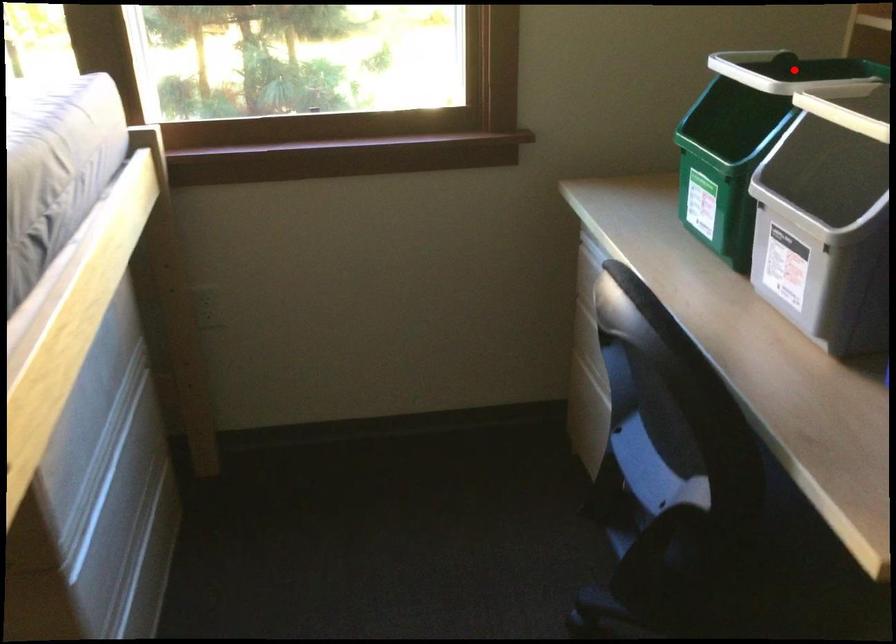
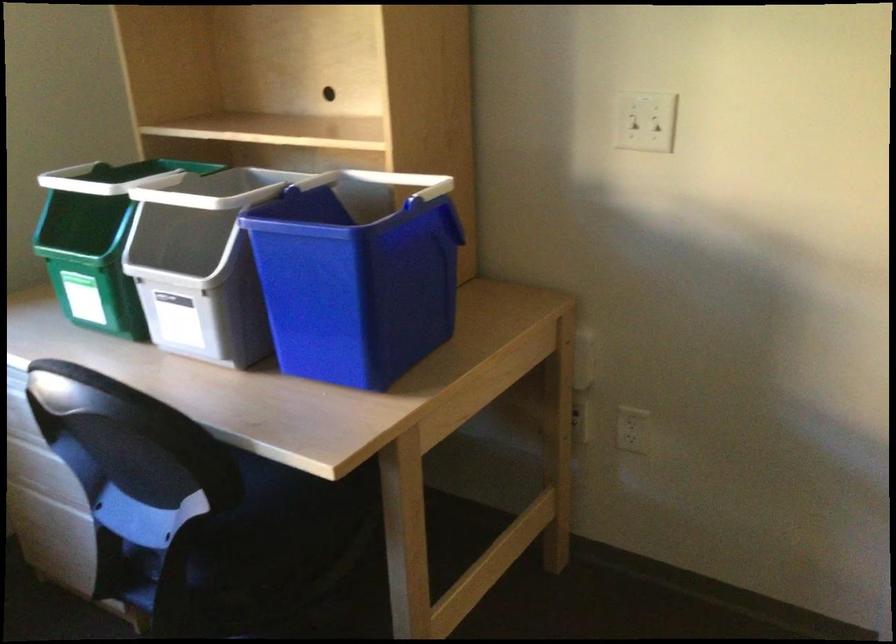
Question: I am providing you with two images of the same scene from different viewpoints. In image1, a red point is highlighted. Considering the same 3D point in image2, which of the following is correct?

Choices:
 (A) It is closer
 (B) It is farther

Answer: (B)